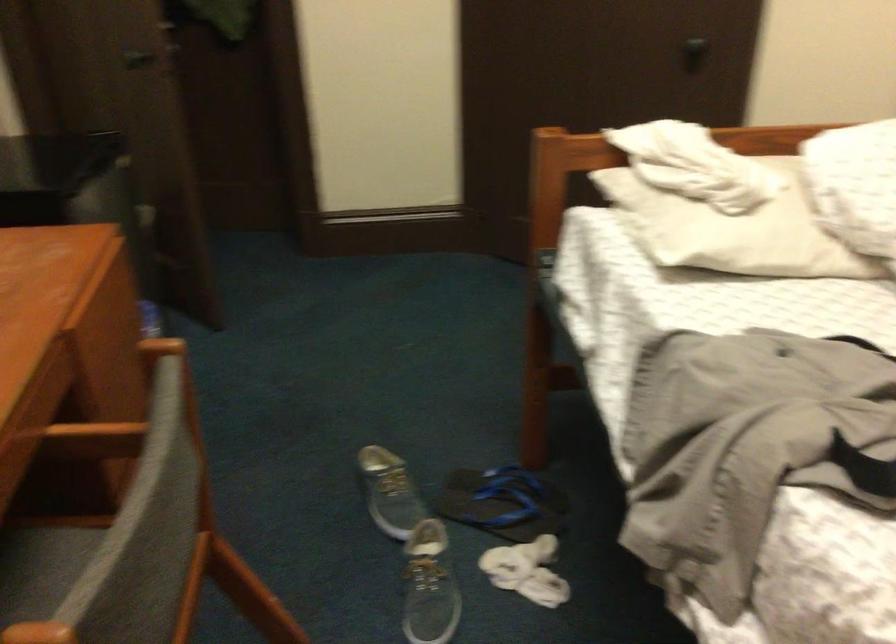
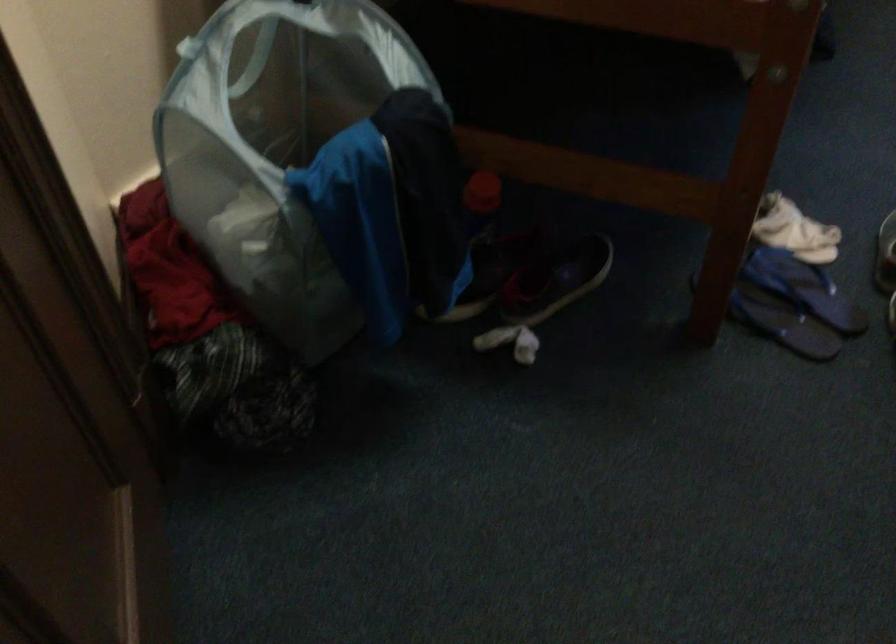
In the second image, find the point that corresponds to point (480, 484) in the first image.

(782, 323)